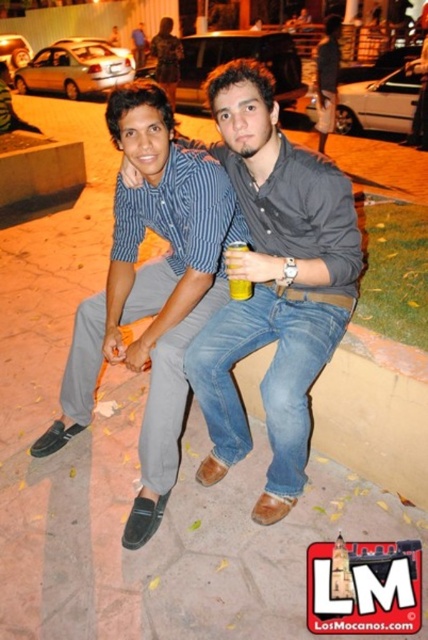
You are standing in front of the two people sitting on the paved ground. You want to throw a small pebble to the person on the left. Which point, point (264,93) or point (163,444), is closer to the person on the left?

Point (264,93) is closer to the person on the left because it is closer to the camera than point (163,444).

You are standing at the point with coordinates point (247, 291) and want to move to the point with coordinates point (234, 198). Can you walk directly towards it without going around any obstacles?

Point (234, 198) is behind point (247, 291), so you cannot walk directly towards it without going around any obstacles.